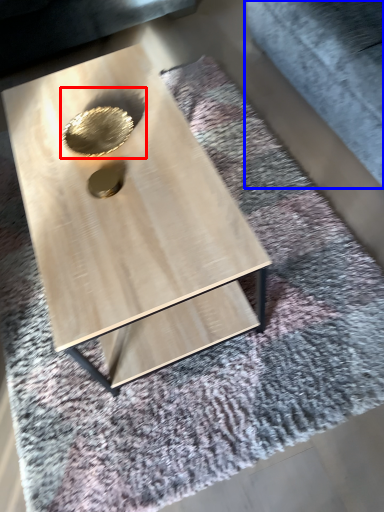
Question: Which point is closer to the camera, hole (highlighted by a red box) or gray (highlighted by a blue box)?

Choices:
 (A) hole
 (B) gray

Answer: (B)